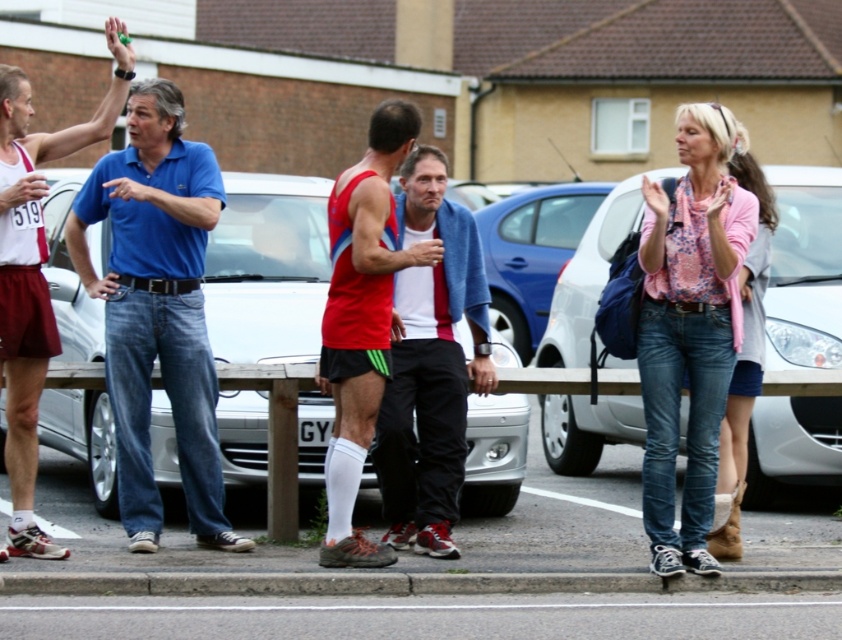
You are a photographer trying to capture a photo of both the pink floral blouse at center and the blue cotton jacket at center. Since you want them both in the frame, which one should you position closer to the left side of your camera viewfinder?

You should position the blue cotton jacket at center closer to the left side of your camera viewfinder because the pink floral blouse at center is to the right of the blue cotton jacket at center.

You are a pedestrian standing at the edge of the road and see the metallic silver car at right and the pink floral blouse at center. Which object is closer to the road?

The metallic silver car at right is closer to the road since it is positioned to the left of the pink floral blouse at center, which is further away.

You are a photographer trying to capture a photo of both the red fabric tank top at center and the matte blue polo shirt at left. Since you want both subjects to be clearly visible in the frame, which one should you focus on first to ensure proper focus?

The red fabric tank top at center is taller than the matte blue polo shirt at left, so you should focus on the red fabric tank top at center first to ensure proper focus since it is larger in the frame.